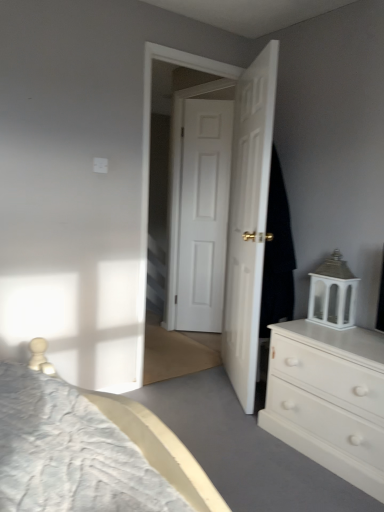
Locate an element on the screen. The height and width of the screenshot is (512, 384). free space below white glossy door at center, positioned as the first door in front-to-back order (from a real-world perspective) is located at coordinates (230, 388).